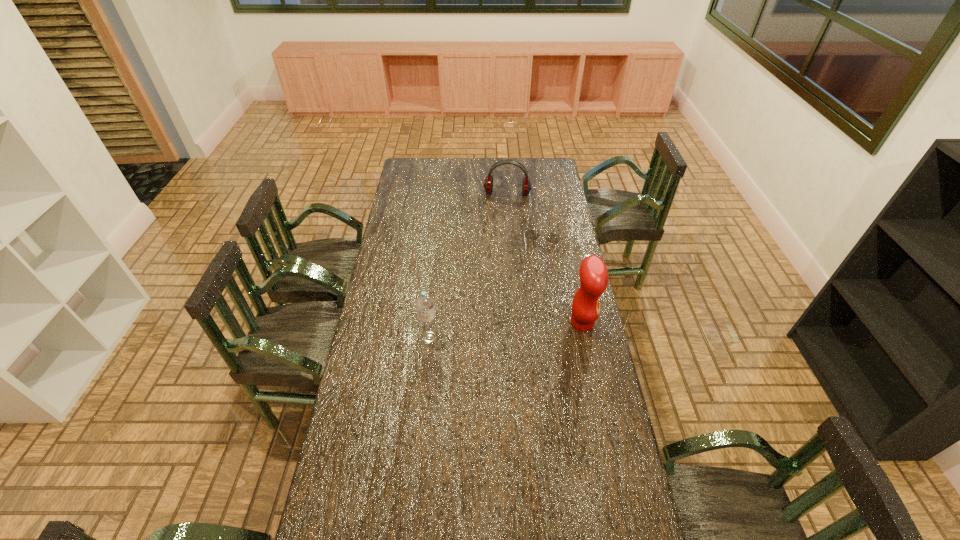
You are a GUI agent. You are given a task and a screenshot of the screen. Output one action in this format:
    pyautogui.click(x=<x>, y=<y>)
    Task: Click on the free space located on the ear cups of the earphone
    The height and width of the screenshot is (540, 960).
    Given the screenshot: What is the action you would take?
    pyautogui.click(x=504, y=211)

You are a GUI agent. You are given a task and a screenshot of the screen. Output one action in this format:
    pyautogui.click(x=<x>, y=<y>)
    Task: Click on the free region located on the front-facing side of the third nearest object
    The width and height of the screenshot is (960, 540).
    Given the screenshot: What is the action you would take?
    pyautogui.click(x=537, y=273)

This screenshot has height=540, width=960. Identify the location of free space located 0.160m on the front-facing side of the third nearest object. (534, 286).

I want to click on vacant region located 0.270m on the front-facing side of the third nearest object, so click(x=530, y=303).

This screenshot has height=540, width=960. In order to click on condiment present at the right edge in this screenshot , I will do `click(593, 272)`.

This screenshot has width=960, height=540. I want to click on spectacles located at the right edge, so click(531, 234).

Identify the location of free space at the far edge of the desktop. This screenshot has width=960, height=540. (468, 176).

In the image, there is a desktop. Identify the location of vacant area at the near edge. (511, 512).

This screenshot has width=960, height=540. In order to click on vacant space at the left edge in this screenshot , I will do `click(348, 482)`.

Locate an element on the screen. The height and width of the screenshot is (540, 960). free region at the right edge of the desktop is located at coordinates (582, 333).